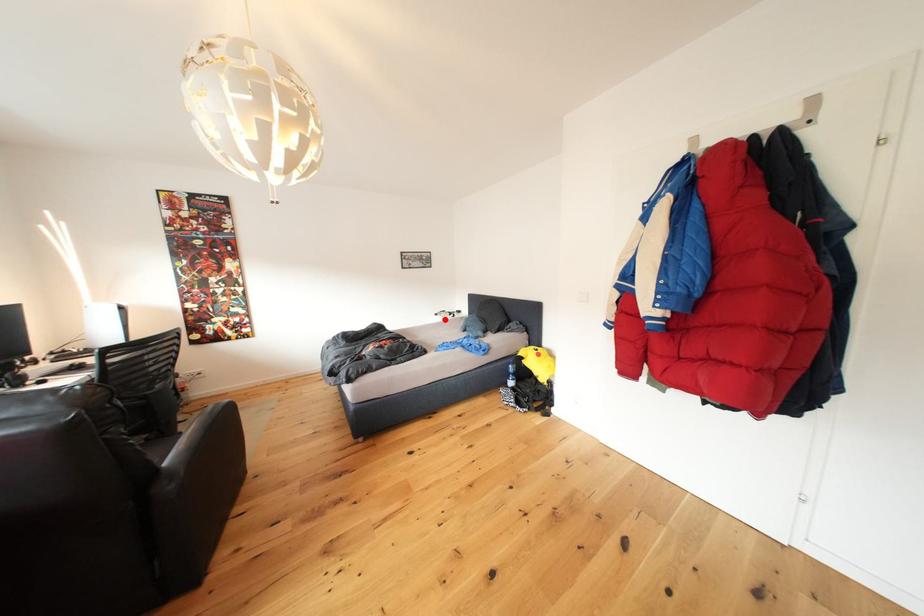
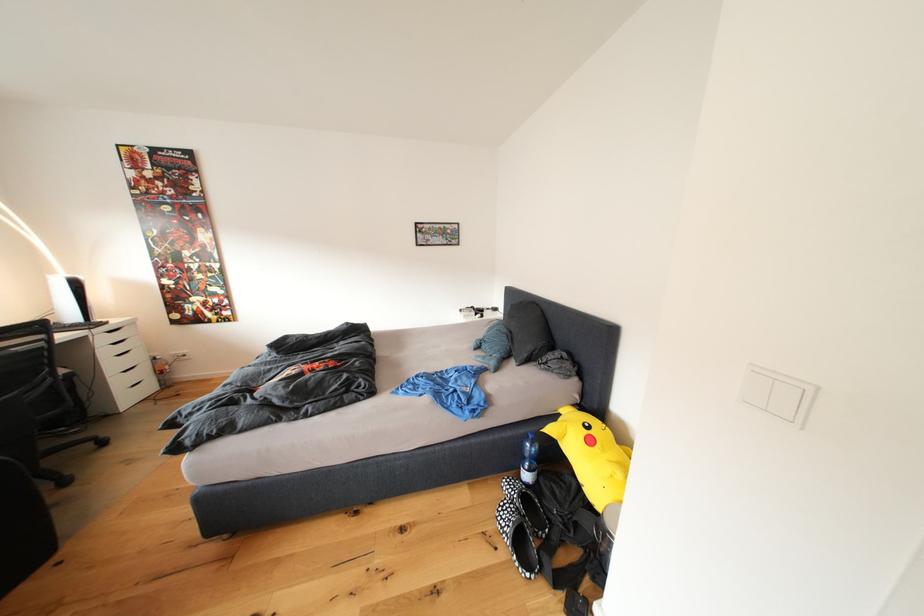
In the second image, find the point that corresponds to the highlighted location in the first image.

(469, 315)